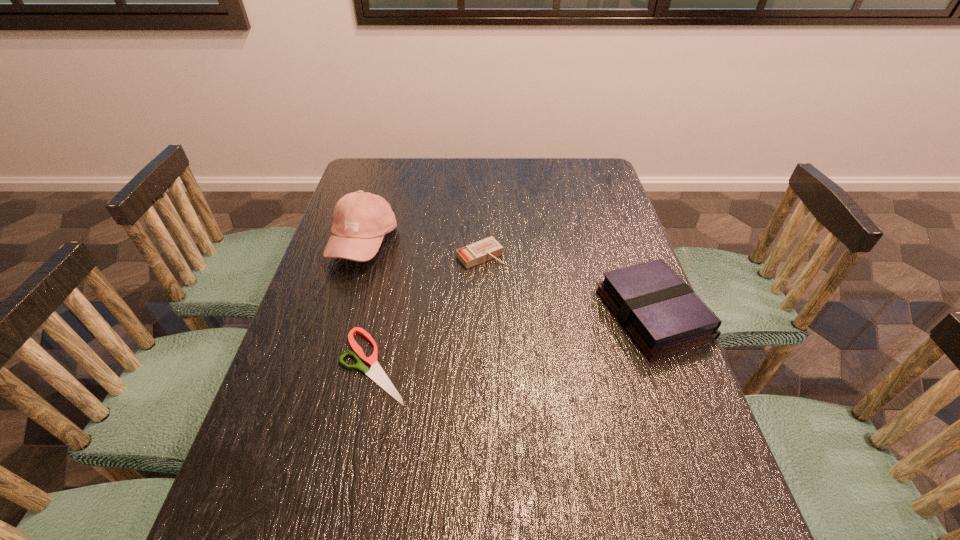
Locate an element on the screen. The height and width of the screenshot is (540, 960). free spot located on the front-facing side of the baseball cap is located at coordinates (427, 299).

Find the location of a particular element. Image resolution: width=960 pixels, height=540 pixels. vacant space located 0.360m on the striking surface of the matchbox is located at coordinates (578, 358).

The width and height of the screenshot is (960, 540). I want to click on vacant space located 0.300m on the striking surface of the matchbox, so click(x=562, y=340).

Where is `free point located 0.080m on the striking surface of the matchbox`? Image resolution: width=960 pixels, height=540 pixels. free point located 0.080m on the striking surface of the matchbox is located at coordinates (510, 284).

Locate an element on the screen. The image size is (960, 540). scissors that is at the left edge is located at coordinates (376, 373).

Identify the location of baseball cap located at the left edge. Image resolution: width=960 pixels, height=540 pixels. (361, 219).

Identify the location of object present at the right edge. This screenshot has width=960, height=540. (660, 312).

Locate an element on the screen. This screenshot has width=960, height=540. vacant region at the far edge is located at coordinates (474, 166).

At what (x,y) coordinates should I click in order to perform the action: click on vacant area at the near edge of the desktop. Please return your answer as a coordinate pair (x, y). Looking at the image, I should click on (529, 485).

Where is `vacant region at the right edge of the desktop`? Image resolution: width=960 pixels, height=540 pixels. vacant region at the right edge of the desktop is located at coordinates (667, 377).